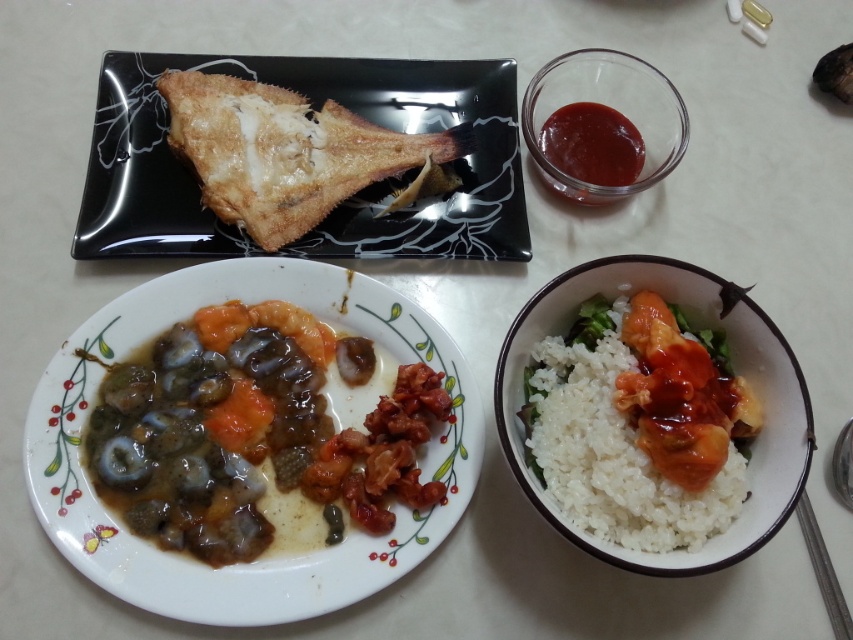
Is shiny brown seafood at center left smaller than white matte rice at lower right?

Actually, shiny brown seafood at center left might be larger than white matte rice at lower right.

Image resolution: width=853 pixels, height=640 pixels. In order to click on shiny brown seafood at center left in this screenshot , I will do `click(254, 433)`.

You are a GUI agent. You are given a task and a screenshot of the screen. Output one action in this format:
    pyautogui.click(x=<x>, y=<y>)
    Task: Click on the shiny brown seafood at center left
    
    Given the screenshot: What is the action you would take?
    pyautogui.click(x=254, y=433)

Who is lower down, shiny brown seafood at center left or golden brown fried fish at upper left?

shiny brown seafood at center left

Is point (231, 476) in front of point (103, 212)?

That is True.

Which is in front, point (252, 388) or point (386, 113)?

Point (252, 388) is in front.

Identify the location of shiny brown seafood at center left. (254, 433).

Which is more to the left, translucent glass bowl at upper right or smooth glossy tomato sauce at upper right?

smooth glossy tomato sauce at upper right

Does translucent glass bowl at upper right have a smaller size compared to smooth glossy tomato sauce at upper right?

No.

Who is more distant from viewer, (648, 140) or (596, 168)?

Point (648, 140)

Locate an element on the screen. This screenshot has height=640, width=853. translucent glass bowl at upper right is located at coordinates (610, 106).